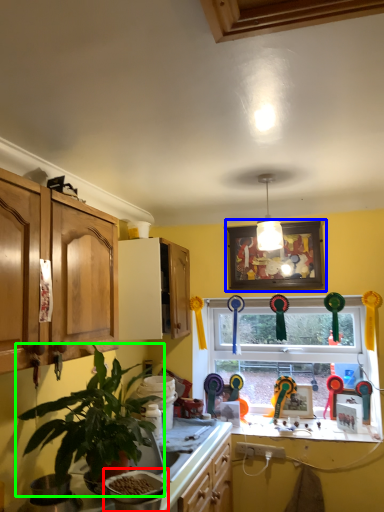
Question: Which object is positioned closest to appliance (highlighted by a red box)? Select from picture frame (highlighted by a blue box) and houseplant (highlighted by a green box).

Choices:
 (A) picture frame
 (B) houseplant

Answer: (B)